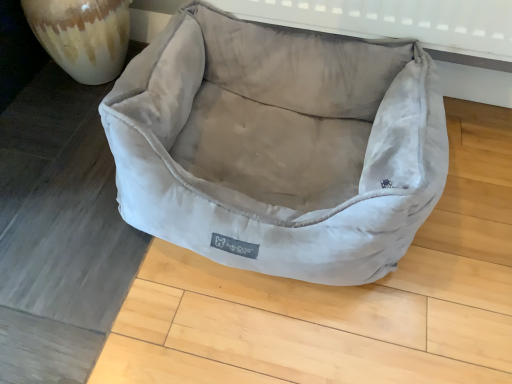
Locate an element on the screen. vacant area that is in front of marbled ceramic vase at left is located at coordinates (59, 123).